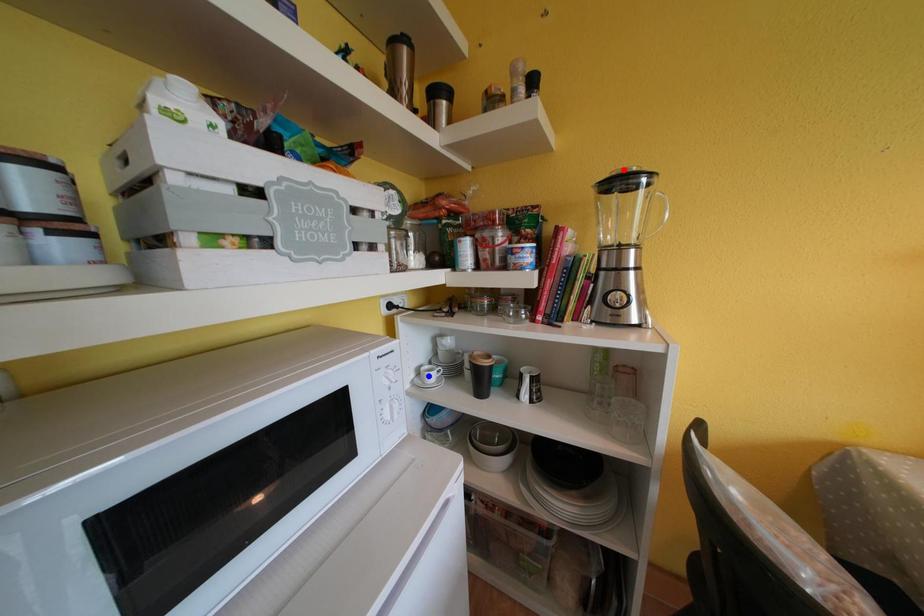
Question: Two points are marked on the image. Which point is closer to the camera?

Choices:
 (A) Blue point is closer.
 (B) Red point is closer.

Answer: (B)